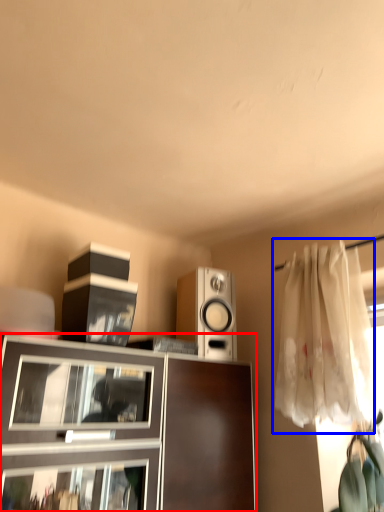
Question: Which object appears farthest to the camera in this image, cabinetry (highlighted by a red box) or curtain (highlighted by a blue box)?

Choices:
 (A) cabinetry
 (B) curtain

Answer: (B)